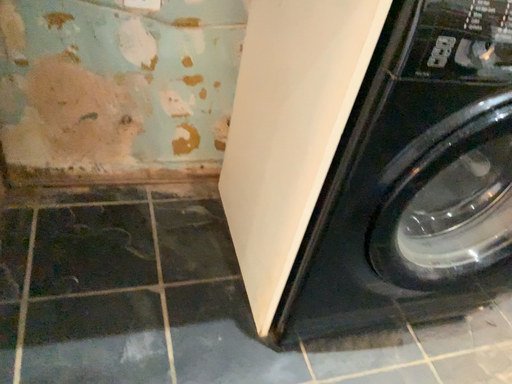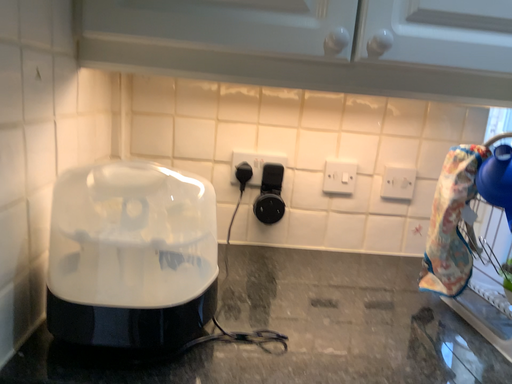
Question: Which way did the camera rotate in the video?

Choices:
 (A) rotated downward
 (B) rotated upward

Answer: (B)